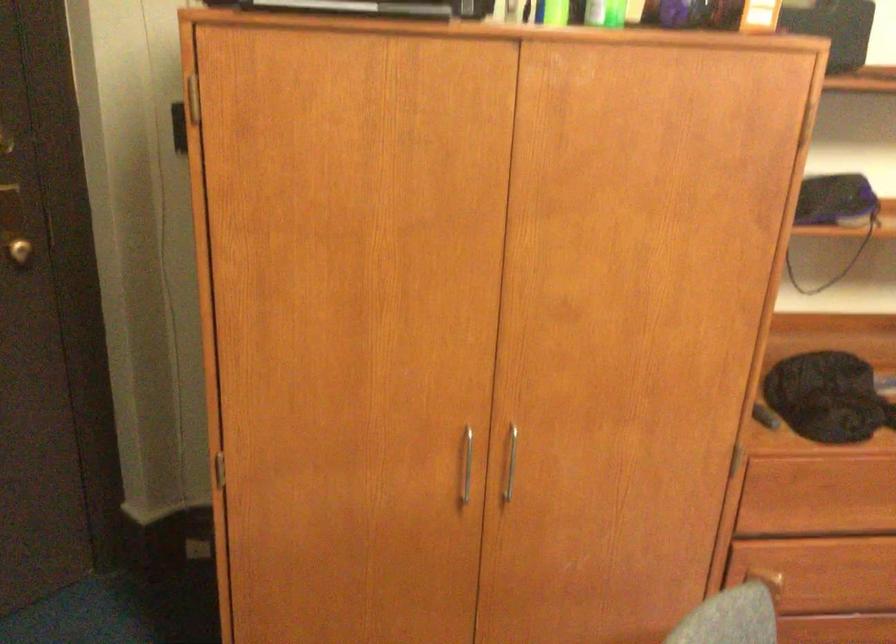
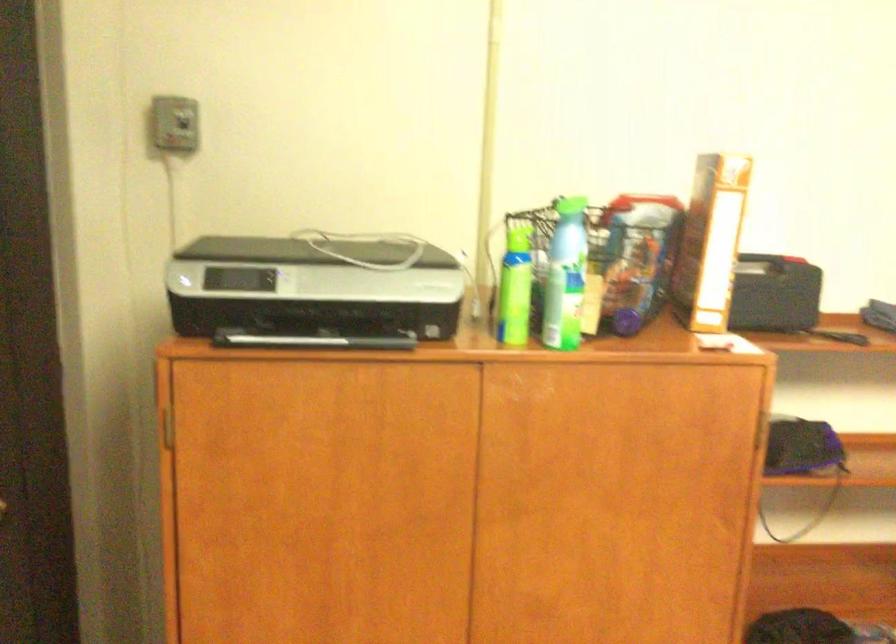
Question: The first image is from the beginning of the video and the second image is from the end. How did the camera likely rotate when shooting the video?

Choices:
 (A) Left
 (B) Right
 (C) Up
 (D) Down

Answer: (C)